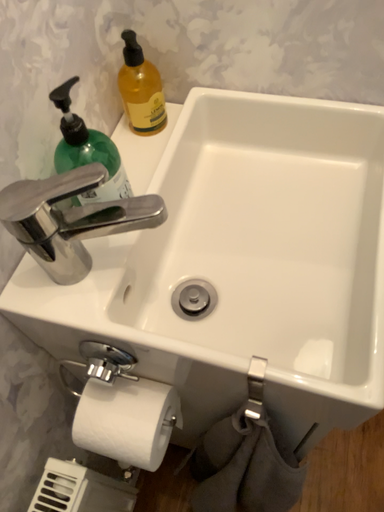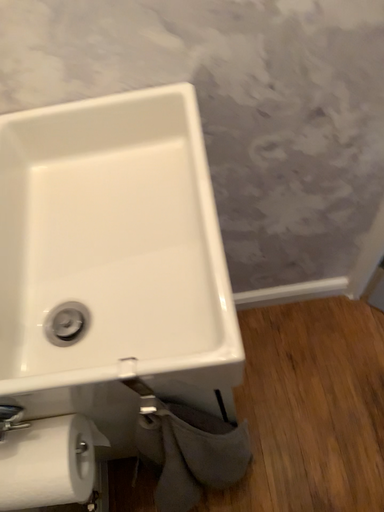
Question: Which way did the camera rotate in the video?

Choices:
 (A) rotated right
 (B) rotated left

Answer: (A)